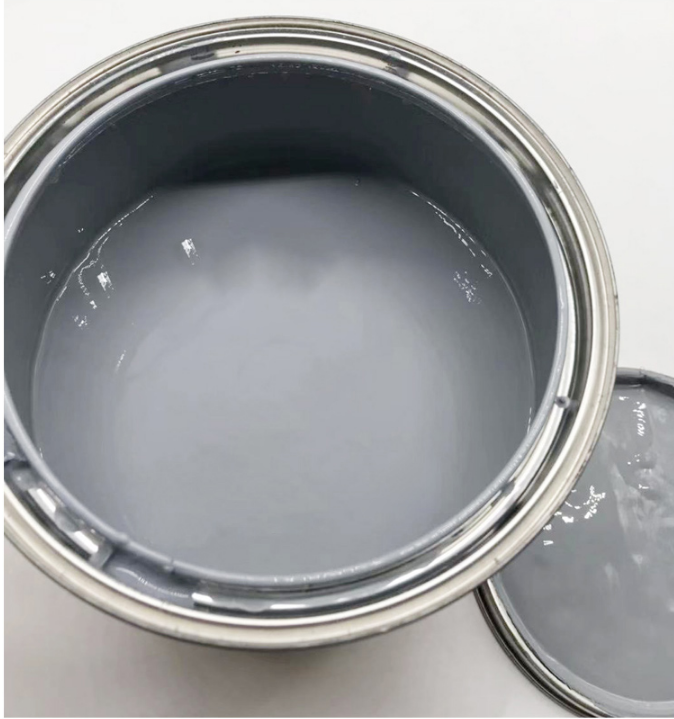
Locate an element on the screen. gray paint is located at coordinates (257, 540).